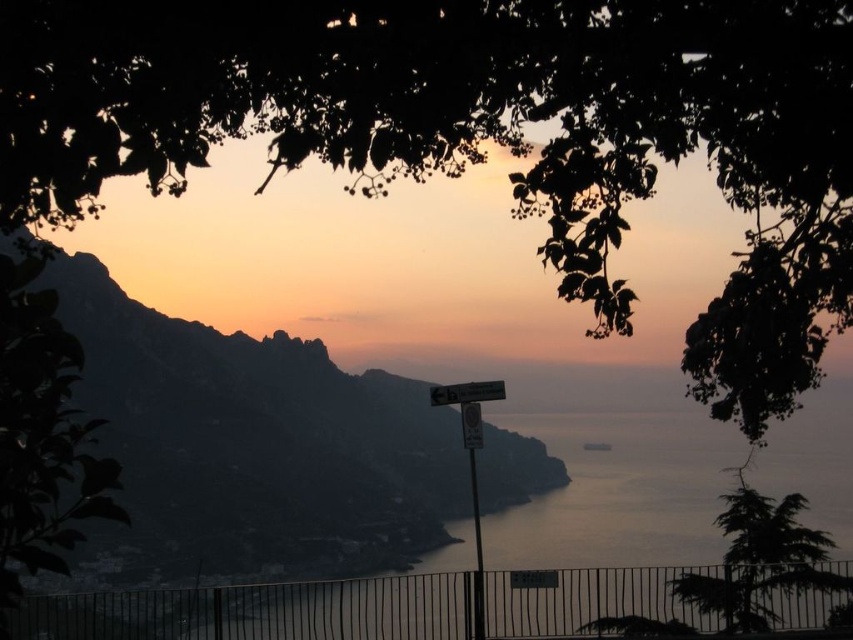
You are standing at the viewpoint looking at the scene. There is a green leafy tree at upper center and a silvery metallic mountain at center. Which object is positioned to the right side of the other?

The green leafy tree at upper center is positioned to the right of the silvery metallic mountain at center.

You are standing at the viewpoint and see the silvery water at center and the green textured tree at lower right. Which object is located to the left of the other?

The silvery water at center is positioned on the left side of green textured tree at lower right.